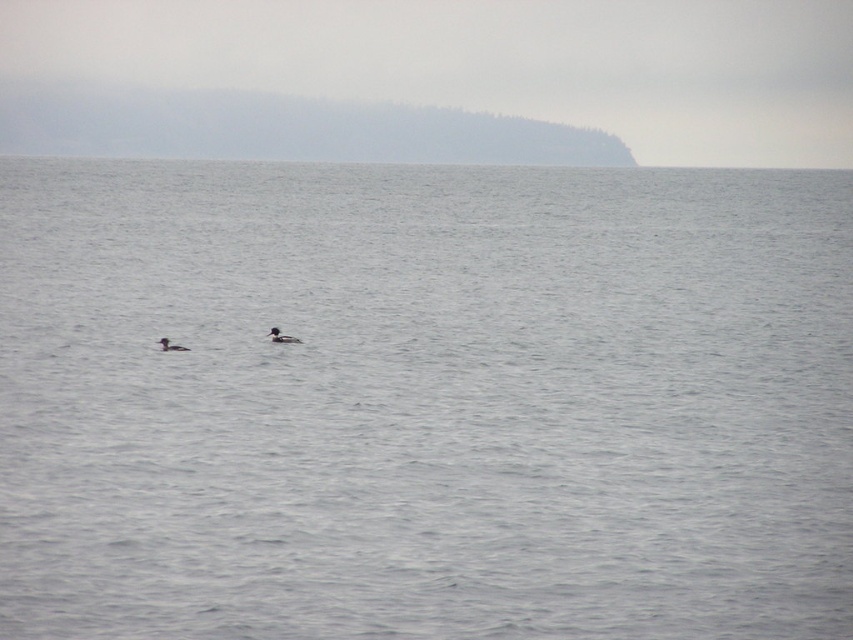
You are a photographer trying to capture the brown matte duck at center in the image. The camera has a grid overlay with coordinates from 0 to 1 on both axes. Where should you aim your camera to ensure the duck is centered in your shot?

The brown matte duck at center is located at coordinates point (x=281, y=337), so you should aim your camera at those coordinates to center it in your shot.